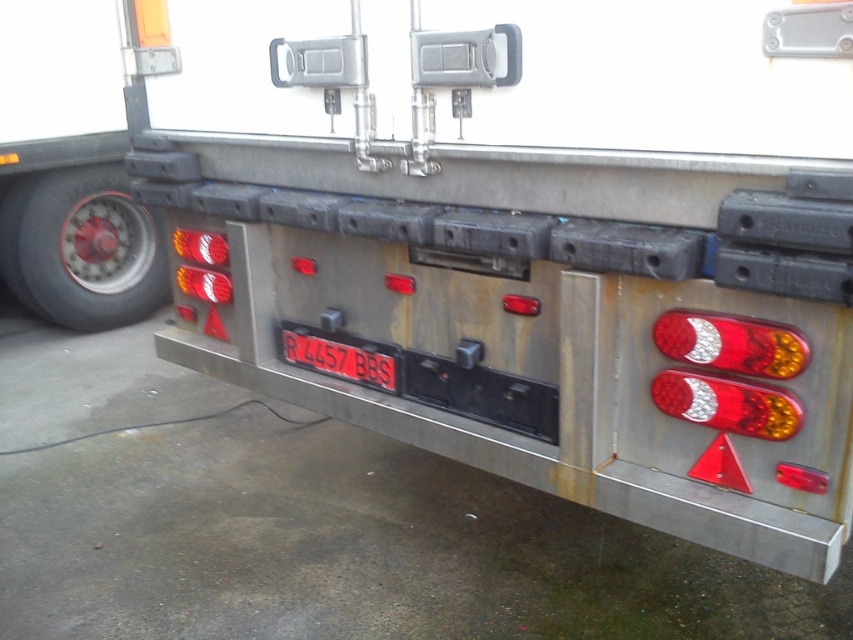
You are a mechanic working on a truck. You need to install a new brake light that is 36.36 inches long. The current brake light is at the right side near the license plate. Is there enough space between the translucent plastic brake light at right and the black plastic license plate at center to install the new brake light?

The translucent plastic brake light at right is 36.36 inches from the black plastic license plate at center. Since the new brake light is 36.36 inches long, the space between them is exactly the length of the new brake light, so there is just enough space to install it.

You are a mechanic inspecting the truck. You notice a point at coordinate (x=727, y=404) on the tailgate. Based on the scene description, what object is located at that coordinate?

The point at coordinate (x=727, y=404) corresponds to the translucent plastic brake light at right.